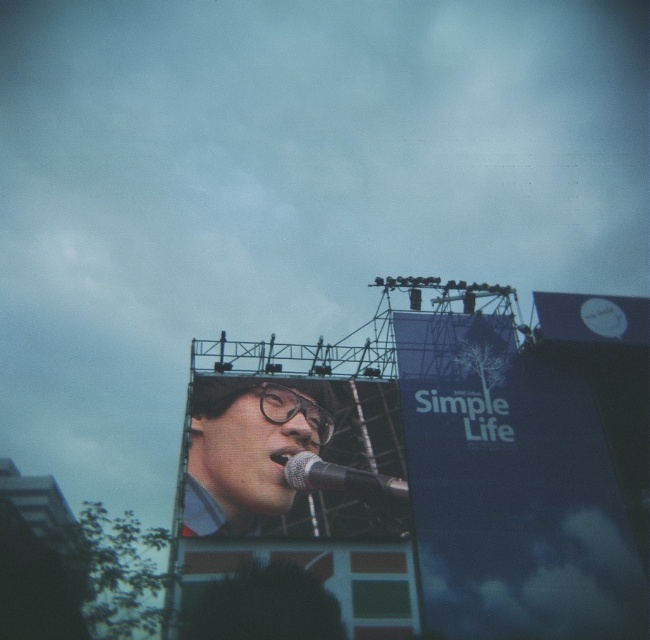
Between blue matte signboard at upper right and silver metallic microphone at center, which one is positioned lower?

silver metallic microphone at center is below.

How distant is blue matte signboard at upper right from silver metallic microphone at center?

blue matte signboard at upper right is 11.64 meters away from silver metallic microphone at center.

Is point (512, 429) positioned after point (341, 476)?

Yes, it is behind point (341, 476).

Image resolution: width=650 pixels, height=640 pixels. I want to click on blue matte signboard at upper right, so click(x=510, y=490).

Between blue matte signboard at upper right and matte black microphone at center, which one has more height?

With more height is blue matte signboard at upper right.

Can you confirm if blue matte signboard at upper right is positioned to the right of matte black microphone at center?

Correct, you'll find blue matte signboard at upper right to the right of matte black microphone at center.

Does point (523, 496) lie in front of point (228, 528)?

No, it is not.

The width and height of the screenshot is (650, 640). Find the location of `blue matte signboard at upper right`. blue matte signboard at upper right is located at coordinates (510, 490).

Based on the photo, which of these two, matte black microphone at center or green fabric banner at lower center, stands taller?

Standing taller between the two is matte black microphone at center.

Which is below, matte black microphone at center or green fabric banner at lower center?

green fabric banner at lower center is below.

Locate an element on the screen. matte black microphone at center is located at coordinates (247, 451).

Where is `matte black microphone at center`? The image size is (650, 640). matte black microphone at center is located at coordinates (247, 451).